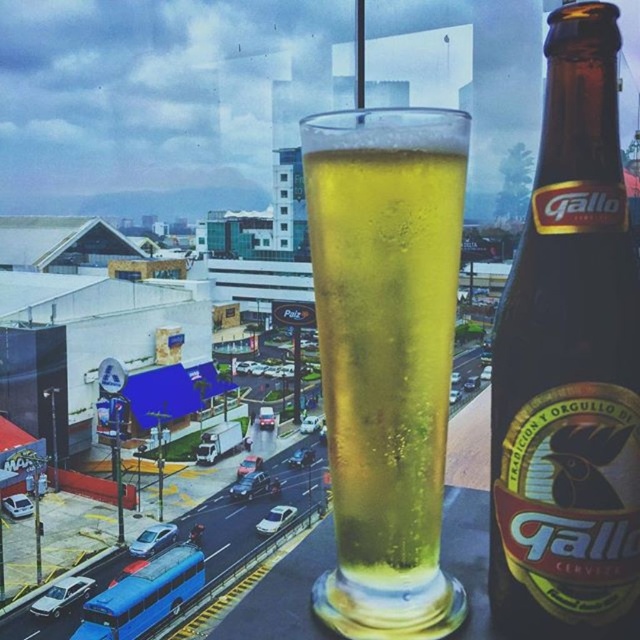
You are a photographer trying to capture the entire scene in one shot. You notice two points in the image at coordinates point [586,634] and point [444,173]. Since you want to ensure both points are in focus, which point should you focus on to maximize the depth of field?

To maximize depth of field for both points, focus on point [444,173] since it is farther from the camera compared to point [586,634].

You are at a bar and want to pour the contents of the brown glass bottle at center into the translucent glass at center. Based on their sizes, will the bottle fit entirely inside the glass?

The brown glass bottle at center has a lesser width compared to the translucent glass at center, so the bottle can fit inside the glass as its width is smaller.

You are at a bar and want to pour the contents of the brown glass bottle at center into the translucent glass at center. Can you do this without spilling?

The brown glass bottle at center is above the translucent glass at center, so pouring the contents from the brown glass bottle at center into the translucent glass at center should be possible without spilling as long as the bottle is positioned correctly above the glass.